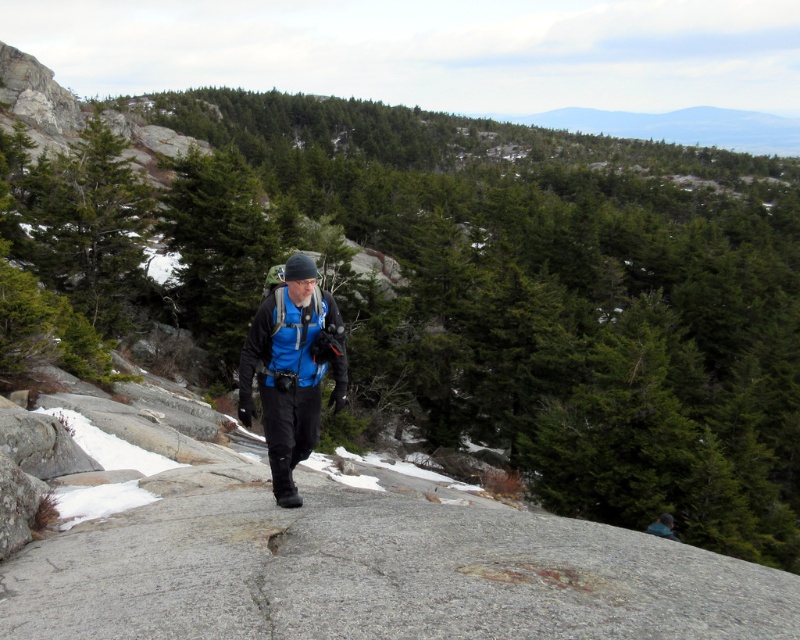
Question: Is blue matte jacket at center bigger than blue fabric backpack at center?

Choices:
 (A) yes
 (B) no

Answer: (A)

Question: Can you confirm if blue matte jacket at center is wider than blue fabric backpack at center?

Choices:
 (A) yes
 (B) no

Answer: (A)

Question: Which of the following is the closest to the observer?

Choices:
 (A) blue matte jacket at center
 (B) blue fabric backpack at center

Answer: (A)

Question: Does blue matte jacket at center lie in front of blue fabric backpack at center?

Choices:
 (A) yes
 (B) no

Answer: (A)